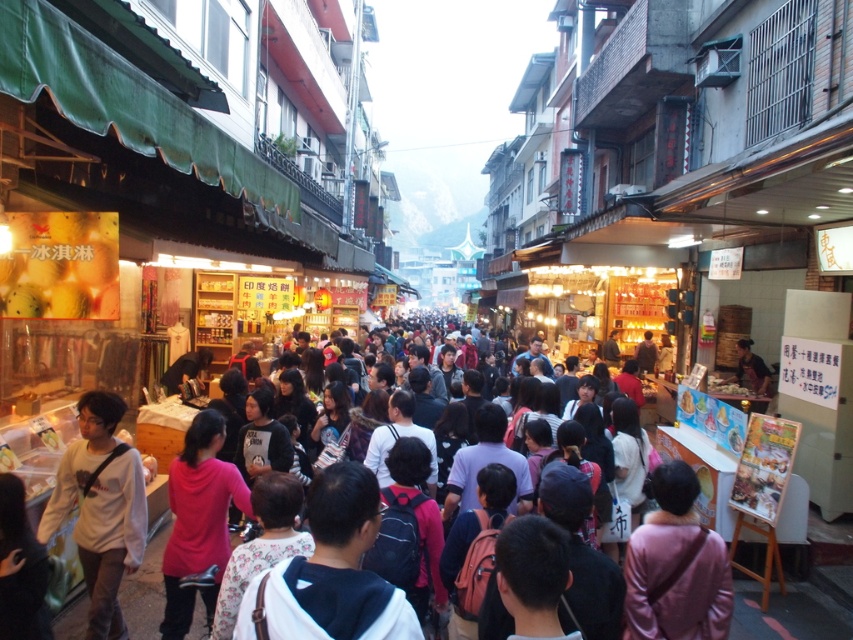
You are a customer at the market and want to buy a sweatshirt and a jacket. You notice the white matte sweatshirt at center and the dark brown leather jacket at center. Which one is smaller in size?

The white matte sweatshirt at center is smaller in size compared to the dark brown leather jacket at center.

You are standing in the middle of the street market and want to reach both the ice cream stall and the food stand. Which of the two points, point [86,464] or point [714,636], is closer to you?

Point [86,464] is closer to you because it is further to the viewer than point [714,636].

You are a customer browsing the stalls at the market and notice two items displayed at center. Which item is taller between the white matte sweatshirt at center and the dark brown leather jacket at center?

The white matte sweatshirt at center is taller than the dark brown leather jacket at center according to the description.